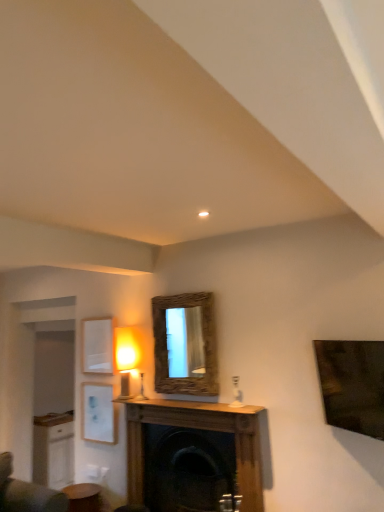
I want to click on free point above wooden table at lower left (from a real-world perspective), so click(74, 489).